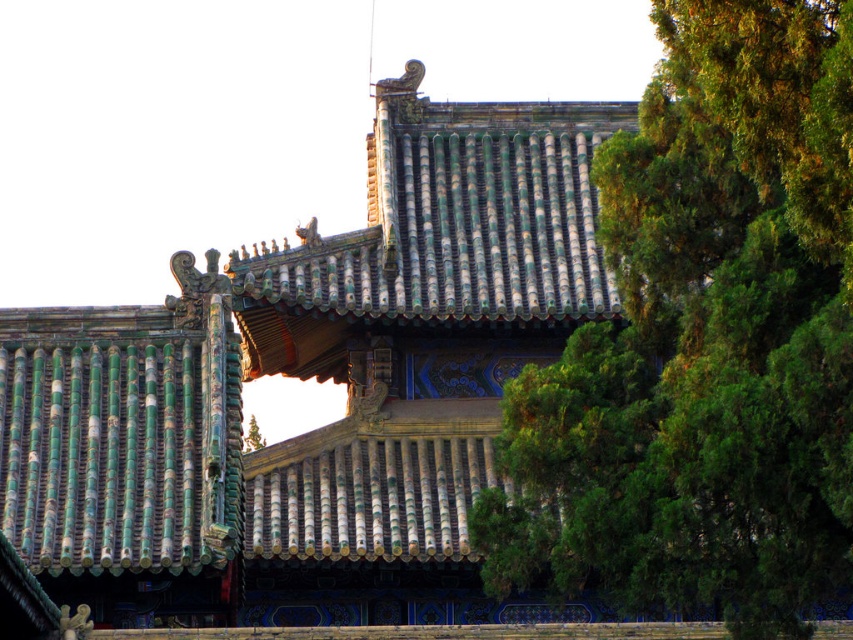
Does green glazed tiles at center appear under green leafy tree at upper right?

No, green glazed tiles at center is not below green leafy tree at upper right.

Between point (199, 284) and point (489, 550), which one is positioned in front?

Point (489, 550) is more forward.

Locate an element on the screen. This screenshot has height=640, width=853. green glazed tiles at center is located at coordinates (317, 380).